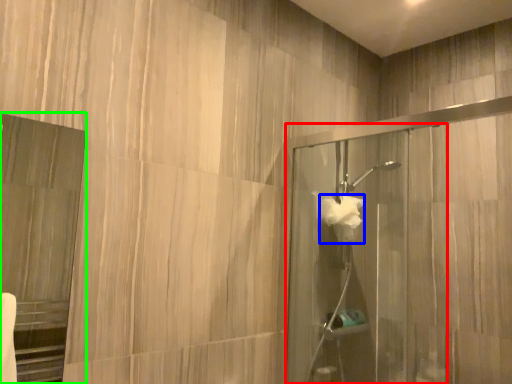
Question: Which object is the closest to the screen door (highlighted by a red box)? Choose among these: hand towel (highlighted by a blue box) or screen door (highlighted by a green box).

Choices:
 (A) hand towel
 (B) screen door

Answer: (A)